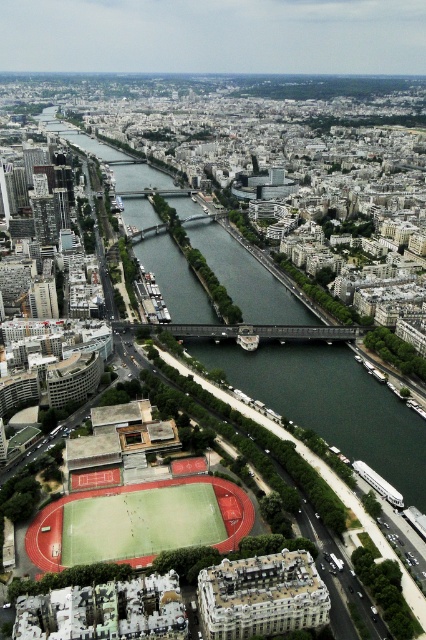
Can you confirm if dark green water at center is bigger than green turf football field at lower center?

Indeed, dark green water at center has a larger size compared to green turf football field at lower center.

Is dark green water at center to the right of green turf football field at lower center from the viewer's perspective?

Incorrect, dark green water at center is not on the right side of green turf football field at lower center.

This screenshot has width=426, height=640. What are the coordinates of `dark green water at center` in the screenshot? It's located at (336, 406).

Where is `dark green water at center`? This screenshot has width=426, height=640. dark green water at center is located at coordinates (336, 406).